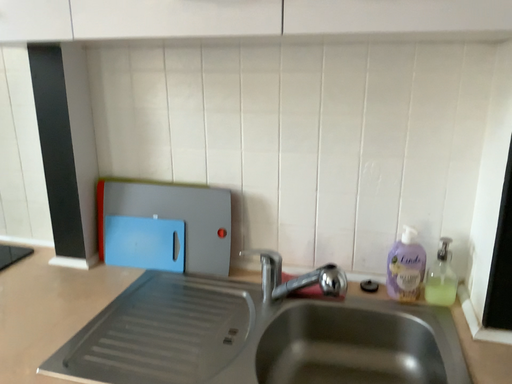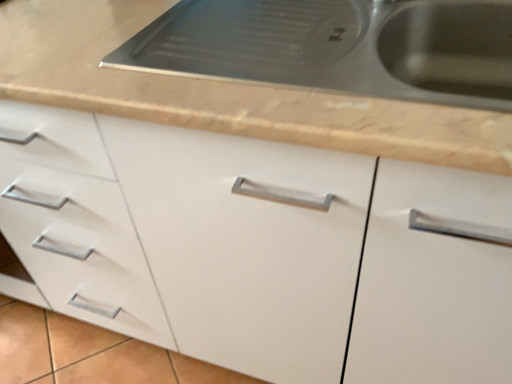
Question: How did the camera likely rotate when shooting the video?

Choices:
 (A) rotated upward
 (B) rotated downward

Answer: (B)